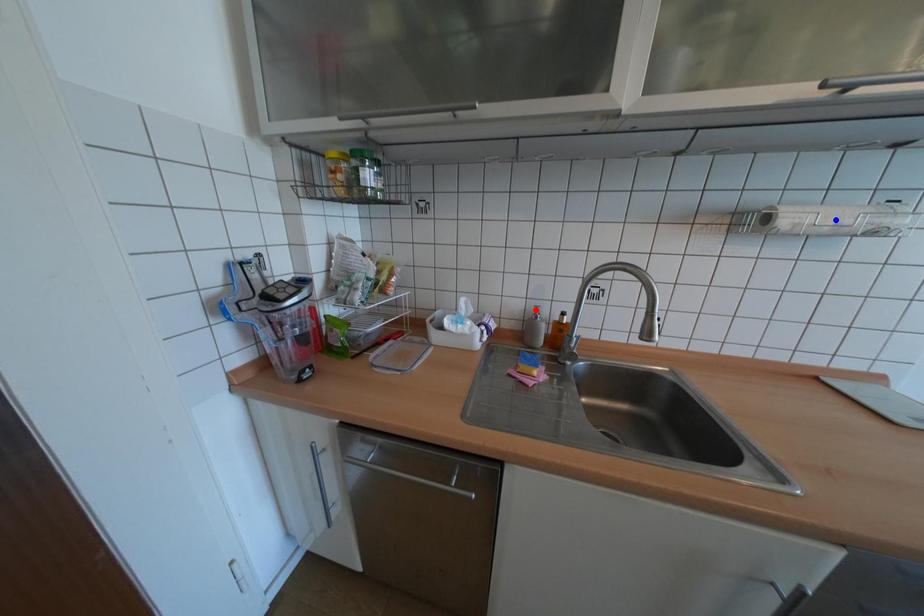
Question: In the image, two points are highlighted. Which point is nearer to the camera? Reply with the corresponding letter.

Choices:
 (A) blue point
 (B) red point

Answer: (A)